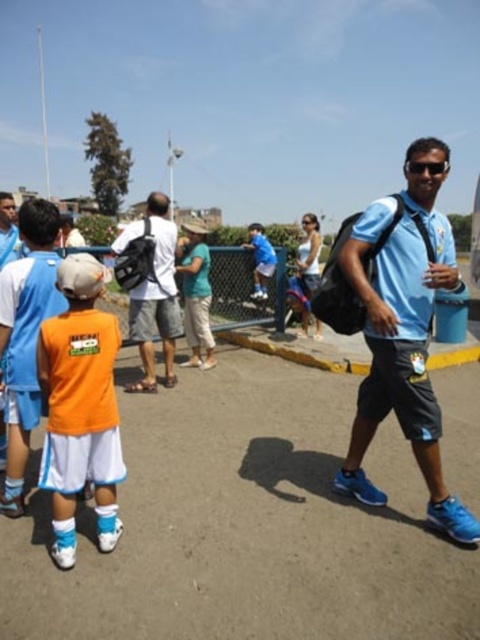
You are standing in the scene and need to pass between the light blue fabric shirt at center and the orange fabric shirt at left. Can you walk through the space between them without touching either?

The light blue fabric shirt at center is wider than orange fabric shirt at left, so the space between them might be too narrow for you to pass through without touching either.

You are standing in the scene and want to hand a water bottle to the person wearing the light blue fabric shirt at center. To do this, should you move towards the matte black backpack at center or away from it?

You should move towards the matte black backpack at center because the light blue fabric shirt at center is to the right of the matte black backpack at center, so moving toward the backpack would place you closer to the shirt wearer.